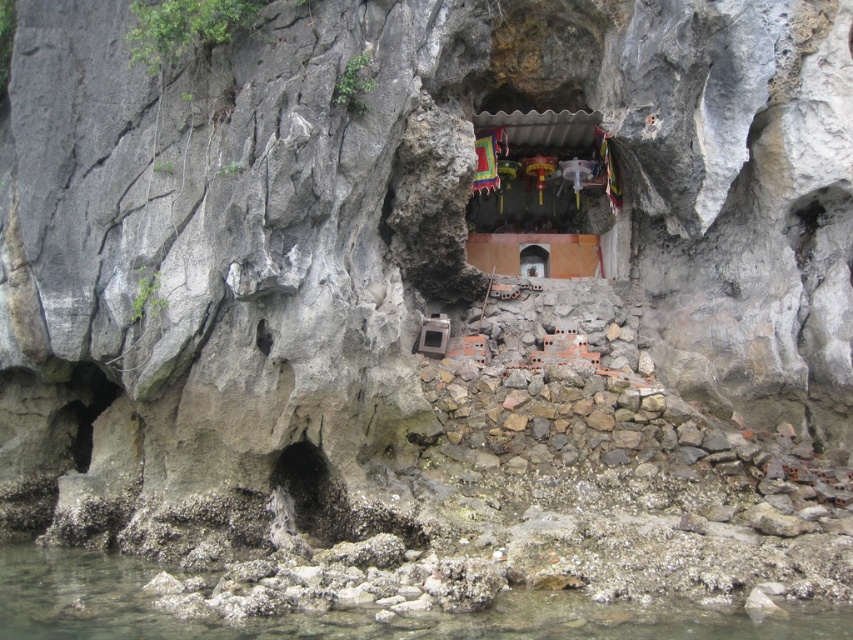
You are a hiker who wants to pour water from a bottle into the clear water at lower left and the matte stone altar at center. Which object should you pour the water into if you want it to stay visible longer?

The matte stone altar at center will retain the poured water longer because the clear water at lower left is positioned on the left side of it, implying it might be a flowing or lower area where water could drain away.

You are a hiker who wants to pour water from the clear water at lower left onto the matte stone altar at center. Can you do this without moving the altar?

The clear water at lower left is in front of the matte stone altar at center, so you can pour the water from the clear water at lower left onto the matte stone altar at center without needing to move the altar since the water source is already positioned in front of it.

You are a hiker who wants to fill your water bottle. You see clear water at lower left and a matte stone altar at center. Which object is located below the other?

The clear water at lower left is positioned under matte stone altar at center, so the clear water is below the altar.